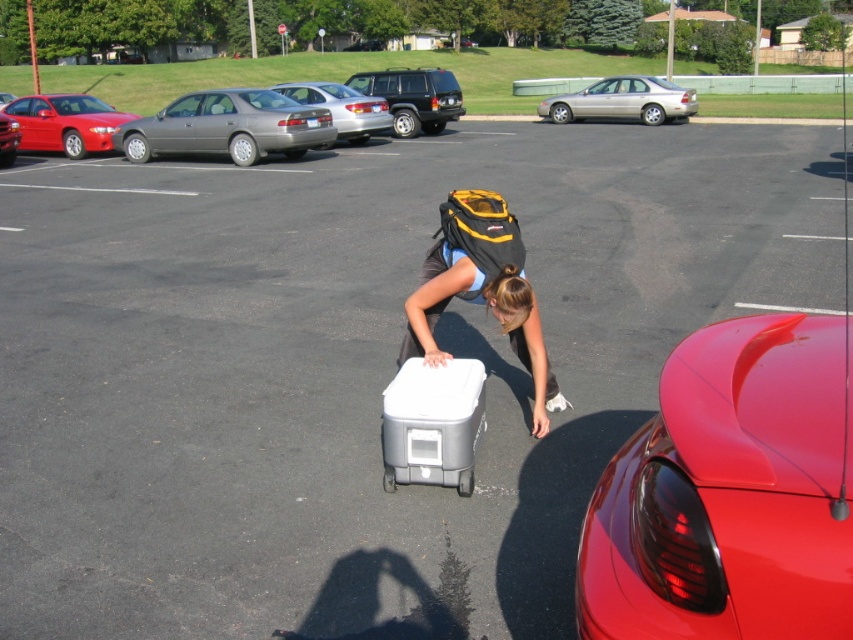
You are a delivery person trying to park your van in the parking lot. You see the silver metallic sedan at center and the silver metallic suv at center. Which vehicle should you avoid if you need to park in a low clearance area?

You should avoid the silver metallic suv at center because it has a greater height than the silver metallic sedan at center, making it less suitable for low clearance areas.

You are a delivery person who needs to park your van in the parking lot. You see the shiny metallic sedan at left and the metallic red car at left. Which vehicle should you move to access the parking spot behind them?

The shiny metallic sedan at left is closer to you than the metallic red car at left, so you should move the shiny metallic sedan at left first to access the parking spot behind them.

You are a parking attendant who needs to determine which vehicle is taller between the shiny metallic sedan at left and the metallic red car at left. Based on the scene, which one is taller?

The shiny metallic sedan at left is taller than the metallic red car at left according to the description.